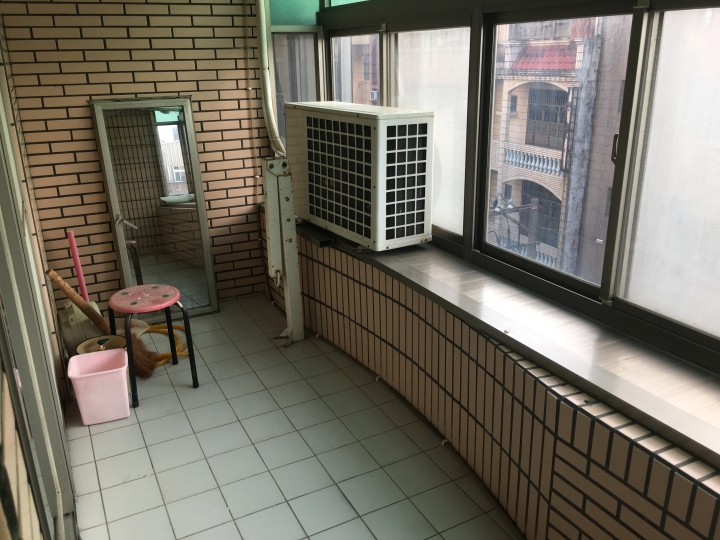
Find the location of a particular element. The width and height of the screenshot is (720, 540). pink trashcan is located at coordinates (94, 388).